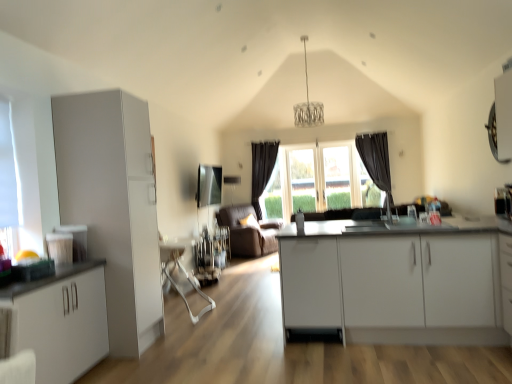
Where is `vacant space underneath white plastic swivel chair at center (from a real-world perspective)`? vacant space underneath white plastic swivel chair at center (from a real-world perspective) is located at coordinates (185, 307).